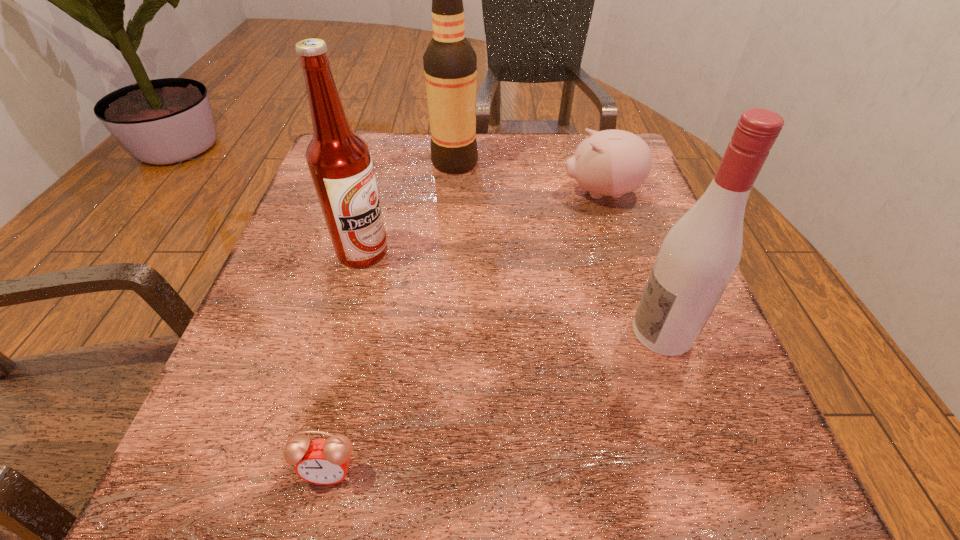
Image resolution: width=960 pixels, height=540 pixels. What are the coordinates of `the farthest alcohol` in the screenshot? It's located at (450, 63).

Image resolution: width=960 pixels, height=540 pixels. Identify the location of the second alcohol from left to right. (450, 63).

I want to click on the second nearest alcohol, so click(x=339, y=161).

The width and height of the screenshot is (960, 540). I want to click on the leftmost alcohol, so click(339, 161).

In order to click on the rightmost alcohol in this screenshot , I will do `click(699, 255)`.

You are a GUI agent. You are given a task and a screenshot of the screen. Output one action in this format:
    pyautogui.click(x=<x>, y=<y>)
    Task: Click on the second nearest object
    
    Given the screenshot: What is the action you would take?
    pyautogui.click(x=699, y=255)

The image size is (960, 540). Identify the location of the fourth nearest object. (612, 162).

Locate an element on the screen. the fourth tallest object is located at coordinates click(x=612, y=162).

Identify the location of alarm clock. (322, 461).

You are a GUI agent. You are given a task and a screenshot of the screen. Output one action in this format:
    pyautogui.click(x=<x>, y=<y>)
    Task: Click on the shortest object
    The image size is (960, 540).
    Given the screenshot: What is the action you would take?
    pyautogui.click(x=322, y=461)